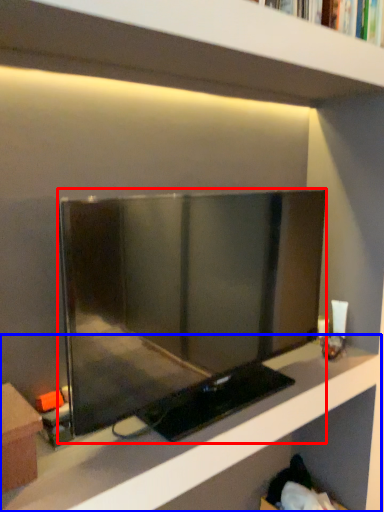
Question: Which point is further to the camera, television (highlighted by a red box) or shelf (highlighted by a blue box)?

Choices:
 (A) television
 (B) shelf

Answer: (A)